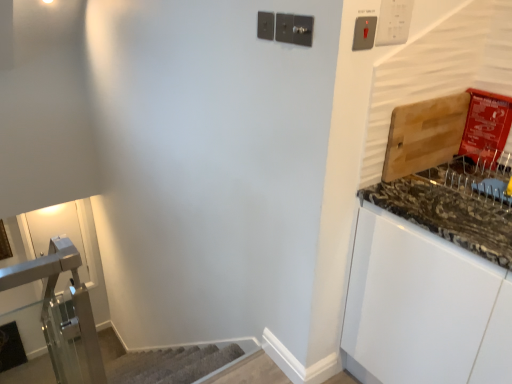
Find the location of a particular element. The image size is (512, 384). white plastic light switch at upper right, which is the third light switch in left-to-right order is located at coordinates (393, 22).

What do you see at coordinates (454, 205) in the screenshot? I see `granite/stone cutting board at right` at bounding box center [454, 205].

At what (x,y) coordinates should I click in order to perform the action: click on metallic silver light switch at upper right, which is counted as the 2th light switch, starting from the left. Please return your answer as a coordinate pair (x, y). Looking at the image, I should click on (364, 33).

Based on the photo, is granite/stone cutting board at right in front of satin nickel light switch at upper center, marked as the third light switch in a right-to-left arrangement?

Yes.

Does granite/stone cutting board at right have a greater height compared to satin nickel light switch at upper center, placed as the first light switch when sorted from left to right?

No.

Is point (474, 174) closer or farther from the camera than point (280, 21)?

Point (474, 174).

Is granite/stone cutting board at right far away from satin nickel light switch at upper center, placed as the first light switch when sorted from left to right?

Actually, granite/stone cutting board at right and satin nickel light switch at upper center, placed as the first light switch when sorted from left to right, are a little close together.

Considering the sizes of white plastic light switch at upper right, the first light switch from the right, and satin nickel light switch at upper center, marked as the third light switch in a right-to-left arrangement, in the image, is white plastic light switch at upper right, the first light switch from the right, taller or shorter than satin nickel light switch at upper center, marked as the third light switch in a right-to-left arrangement,?

In the image, white plastic light switch at upper right, the first light switch from the right, appears to be taller than satin nickel light switch at upper center, marked as the third light switch in a right-to-left arrangement.

In the image, is white plastic light switch at upper right, the first light switch from the right, on the left side or the right side of satin nickel light switch at upper center, placed as the first light switch when sorted from left to right?

white plastic light switch at upper right, the first light switch from the right, is to the right of satin nickel light switch at upper center, placed as the first light switch when sorted from left to right.

How distant is white plastic light switch at upper right, the first light switch from the right, from satin nickel light switch at upper center, placed as the first light switch when sorted from left to right?

white plastic light switch at upper right, the first light switch from the right, and satin nickel light switch at upper center, placed as the first light switch when sorted from left to right, are 10.35 inches apart.

Which of these two, white plastic light switch at upper right, the first light switch from the right, or satin nickel light switch at upper center, marked as the third light switch in a right-to-left arrangement, is bigger?

Bigger between the two is white plastic light switch at upper right, the first light switch from the right.

Find the location of a particular element. The height and width of the screenshot is (384, 512). light switch that appears below the satin nickel light switch at upper center, marked as the third light switch in a right-to-left arrangement (from the image's perspective) is located at coordinates (364, 33).

Does satin nickel light switch at upper center, marked as the third light switch in a right-to-left arrangement, have a lesser height compared to metallic silver light switch at upper right, which is counted as the 2th light switch, starting from the left?

Correct, satin nickel light switch at upper center, marked as the third light switch in a right-to-left arrangement, is not as tall as metallic silver light switch at upper right, which is counted as the 2th light switch, starting from the left.

From a real-world perspective, is satin nickel light switch at upper center, placed as the first light switch when sorted from left to right, physically below metallic silver light switch at upper right, which is counted as the 2th light switch, starting from the left?

No.

Which is correct: white plastic light switch at upper right, the first light switch from the right, is inside granite/stone cutting board at right, or outside of it?

white plastic light switch at upper right, the first light switch from the right, is located beyond the bounds of granite/stone cutting board at right.

Between white plastic light switch at upper right, the first light switch from the right, and granite/stone cutting board at right, which one has smaller width?

Thinner between the two is white plastic light switch at upper right, the first light switch from the right.

How distant is white plastic light switch at upper right, the first light switch from the right, from granite/stone cutting board at right?

A distance of 22.13 inches exists between white plastic light switch at upper right, the first light switch from the right, and granite/stone cutting board at right.

Is white plastic light switch at upper right, the first light switch from the right, not close to granite/stone cutting board at right?

white plastic light switch at upper right, the first light switch from the right, is near granite/stone cutting board at right, not far away.

Which is farther from the camera, (286, 42) or (399, 12)?

Positioned behind is point (286, 42).

Could you tell me if satin nickel light switch at upper center, marked as the third light switch in a right-to-left arrangement, is turned towards white plastic light switch at upper right, which is the third light switch in left-to-right order?

No, satin nickel light switch at upper center, marked as the third light switch in a right-to-left arrangement, is not facing towards white plastic light switch at upper right, which is the third light switch in left-to-right order.

Does satin nickel light switch at upper center, placed as the first light switch when sorted from left to right, have a lesser height compared to white plastic light switch at upper right, the first light switch from the right?

Yes, satin nickel light switch at upper center, placed as the first light switch when sorted from left to right, is shorter than white plastic light switch at upper right, the first light switch from the right.

Who is bigger, metallic silver light switch at upper right, which is counted as the 2th light switch, starting from the left, or granite/stone cutting board at right?

Bigger between the two is granite/stone cutting board at right.

Measure the distance between metallic silver light switch at upper right, which is counted as the 2th light switch, starting from the left, and granite/stone cutting board at right.

metallic silver light switch at upper right, which is counted as the 2th light switch, starting from the left, and granite/stone cutting board at right are 23.04 inches apart.

From a real-world perspective, is metallic silver light switch at upper right, which is counted as the 2th light switch, starting from the left, under granite/stone cutting board at right?

Incorrect, from a real-world perspective, metallic silver light switch at upper right, which is counted as the 2th light switch, starting from the left, is higher than granite/stone cutting board at right.

Is metallic silver light switch at upper right, which is counted as the 2th light switch, starting from the left, spatially inside granite/stone cutting board at right, or outside of it?

The correct answer is: outside.

Is white plastic light switch at upper right, the first light switch from the right, wider or thinner than metallic silver light switch at upper right, which is counted as the 2th light switch, starting from the left?

white plastic light switch at upper right, the first light switch from the right, is thinner than metallic silver light switch at upper right, which is counted as the 2th light switch, starting from the left.

Looking at this image, how many degrees apart are the facing directions of white plastic light switch at upper right, the first light switch from the right, and metallic silver light switch at upper right, the second light switch in the right-to-left sequence?

There is a 0.294-degree angle between the facing directions of white plastic light switch at upper right, the first light switch from the right, and metallic silver light switch at upper right, the second light switch in the right-to-left sequence.

Looking at this image, which of these two, white plastic light switch at upper right, which is the third light switch in left-to-right order, or metallic silver light switch at upper right, the second light switch in the right-to-left sequence, is smaller?

metallic silver light switch at upper right, the second light switch in the right-to-left sequence.

Which object is positioned more to the right, white plastic light switch at upper right, the first light switch from the right, or metallic silver light switch at upper right, the second light switch in the right-to-left sequence?

Positioned to the right is white plastic light switch at upper right, the first light switch from the right.

You are a GUI agent. You are given a task and a screenshot of the screen. Output one action in this format:
    pyautogui.click(x=<x>, y=<y>)
    Task: Click on the light switch that is the 2nd one above the granite/stone cutting board at right (from a real-world perspective)
    The image size is (512, 384).
    Given the screenshot: What is the action you would take?
    pyautogui.click(x=294, y=29)

The width and height of the screenshot is (512, 384). I want to click on the 1st light switch below the white plastic light switch at upper right, which is the third light switch in left-to-right order (from a real-world perspective), so click(x=294, y=29).

Based on their spatial positions, is white plastic light switch at upper right, which is the third light switch in left-to-right order, or granite/stone cutting board at right closer to satin nickel light switch at upper center, placed as the first light switch when sorted from left to right?

white plastic light switch at upper right, which is the third light switch in left-to-right order, lies closer to satin nickel light switch at upper center, placed as the first light switch when sorted from left to right, than the other object.

Estimate the real-world distances between objects in this image. Which object is further from granite/stone cutting board at right, white plastic light switch at upper right, which is the third light switch in left-to-right order, or satin nickel light switch at upper center, placed as the first light switch when sorted from left to right?

Based on the image, satin nickel light switch at upper center, placed as the first light switch when sorted from left to right, appears to be further to granite/stone cutting board at right.

When comparing their distances from white plastic light switch at upper right, which is the third light switch in left-to-right order, does granite/stone cutting board at right or metallic silver light switch at upper right, the second light switch in the right-to-left sequence, seem further?

granite/stone cutting board at right is further to white plastic light switch at upper right, which is the third light switch in left-to-right order.

Considering their positions, is white plastic light switch at upper right, the first light switch from the right, positioned closer to metallic silver light switch at upper right, which is counted as the 2th light switch, starting from the left, than granite/stone cutting board at right?

The object closer to metallic silver light switch at upper right, which is counted as the 2th light switch, starting from the left, is white plastic light switch at upper right, the first light switch from the right.

Considering their positions, is granite/stone cutting board at right positioned closer to metallic silver light switch at upper right, which is counted as the 2th light switch, starting from the left, than white plastic light switch at upper right, which is the third light switch in left-to-right order?

white plastic light switch at upper right, which is the third light switch in left-to-right order, is closer to metallic silver light switch at upper right, which is counted as the 2th light switch, starting from the left.

From the picture: Based on their spatial positions, is metallic silver light switch at upper right, which is counted as the 2th light switch, starting from the left, or satin nickel light switch at upper center, placed as the first light switch when sorted from left to right, closer to white plastic light switch at upper right, which is the third light switch in left-to-right order?

metallic silver light switch at upper right, which is counted as the 2th light switch, starting from the left, lies closer to white plastic light switch at upper right, which is the third light switch in left-to-right order, than the other object.

Which object lies nearer to the anchor point granite/stone cutting board at right, satin nickel light switch at upper center, placed as the first light switch when sorted from left to right, or metallic silver light switch at upper right, the second light switch in the right-to-left sequence?

metallic silver light switch at upper right, the second light switch in the right-to-left sequence, is positioned closer to the anchor granite/stone cutting board at right.

Based on their spatial positions, is metallic silver light switch at upper right, the second light switch in the right-to-left sequence, or granite/stone cutting board at right further from white plastic light switch at upper right, the first light switch from the right?

granite/stone cutting board at right lies further to white plastic light switch at upper right, the first light switch from the right, than the other object.

Identify the location of light switch between satin nickel light switch at upper center, placed as the first light switch when sorted from left to right, and white plastic light switch at upper right, the first light switch from the right. The width and height of the screenshot is (512, 384). (364, 33).